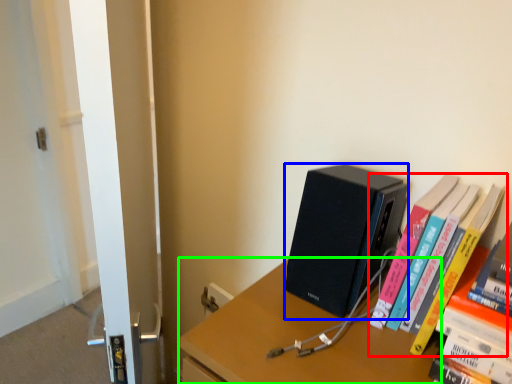
Question: Based on their relative distances, which object is nearer to book (highlighted by a red box)? Choose from computer (highlighted by a blue box) and desk (highlighted by a green box).

Choices:
 (A) computer
 (B) desk

Answer: (A)